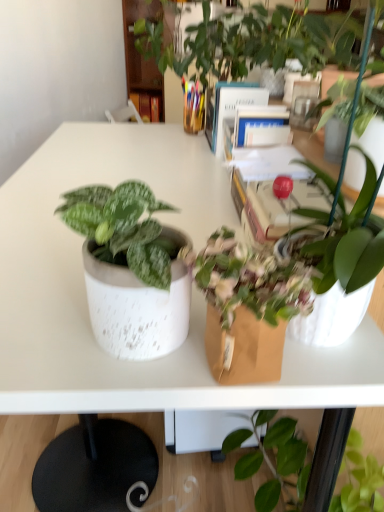
Question: Is blue hardcover book at upper center, marked as the 2th book in a left-to-right arrangement, inside or outside of hardcover book at center, marked as the 3th book in a top-to-bottom arrangement?

Choices:
 (A) outside
 (B) inside

Answer: (A)

Question: Is point (218, 115) closer or farther from the camera than point (276, 124)?

Choices:
 (A) farther
 (B) closer

Answer: (A)

Question: Which is nearer to the hardcover book at center, the first book positioned from the front?

Choices:
 (A) hardcover book at center, acting as the 3th book starting from the bottom
 (B) blue hardcover book at upper center, placed as the second book when sorted from bottom to top

Answer: (B)

Question: Which of these objects is positioned farthest from the hardcover book at center, the first book positioned from the front?

Choices:
 (A) hardcover book at center, the first book viewed from the back
 (B) blue hardcover book at upper center, placed as the second book when sorted from bottom to top

Answer: (A)